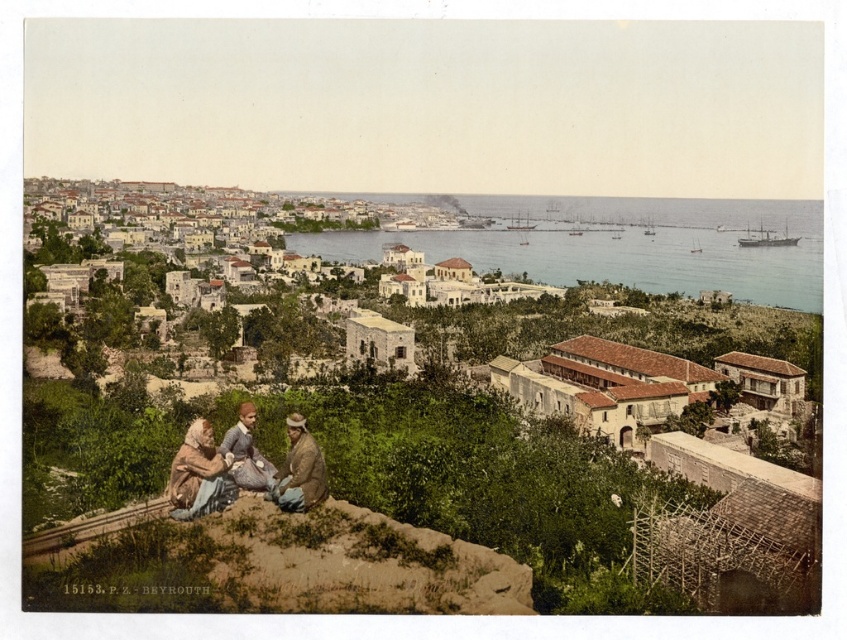
Who is more forward, (176,220) or (677,198)?

Point (176,220) is more forward.

Does light beige stone buildings at center have a lesser width compared to blue water at center?

No.

Is point (214, 349) positioned in front of point (713, 284)?

Yes, it is in front of point (713, 284).

Locate an element on the screen. This screenshot has width=847, height=640. light beige stone buildings at center is located at coordinates (435, 300).

Does light beige stone buildings at center have a greater height compared to matte brown dress at lower center?

Correct, light beige stone buildings at center is much taller as matte brown dress at lower center.

Is point (165, 353) less distant than point (305, 460)?

No, (165, 353) is further to viewer.

Is point (180, 282) behind point (267, 480)?

That is True.

At what (x,y) coordinates should I click in order to perform the action: click on light beige stone buildings at center. Please return your answer as a coordinate pair (x, y). Looking at the image, I should click on (435, 300).

Is point (598, 250) positioned before point (311, 481)?

No.

Who is lower down, blue water at center or matte brown dress at lower center?

matte brown dress at lower center

From the picture: Who is more forward, (785,275) or (272,488)?

Point (272,488) is in front.

At what (x,y) coordinates should I click in order to perform the action: click on blue water at center. Please return your answer as a coordinate pair (x, y). Image resolution: width=847 pixels, height=640 pixels. Looking at the image, I should click on (619, 244).